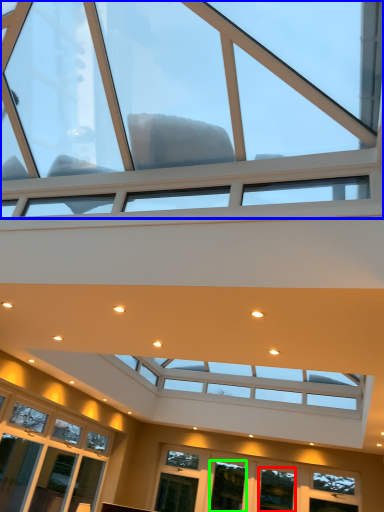
Question: Based on their relative distances, which object is farther from window (highlighted by a red box)? Choose from window (highlighted by a blue box) and window (highlighted by a green box).

Choices:
 (A) window
 (B) window

Answer: (A)